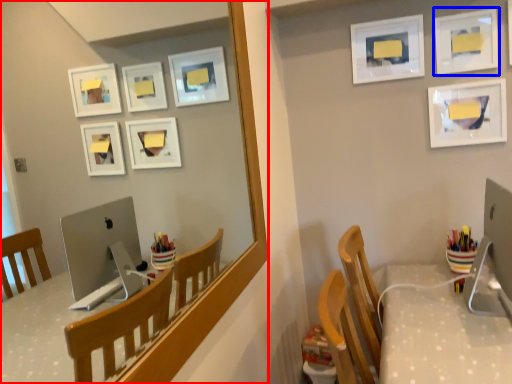
Question: Which point is further to the camera, mirror (highlighted by a red box) or picture frame (highlighted by a blue box)?

Choices:
 (A) mirror
 (B) picture frame

Answer: (B)